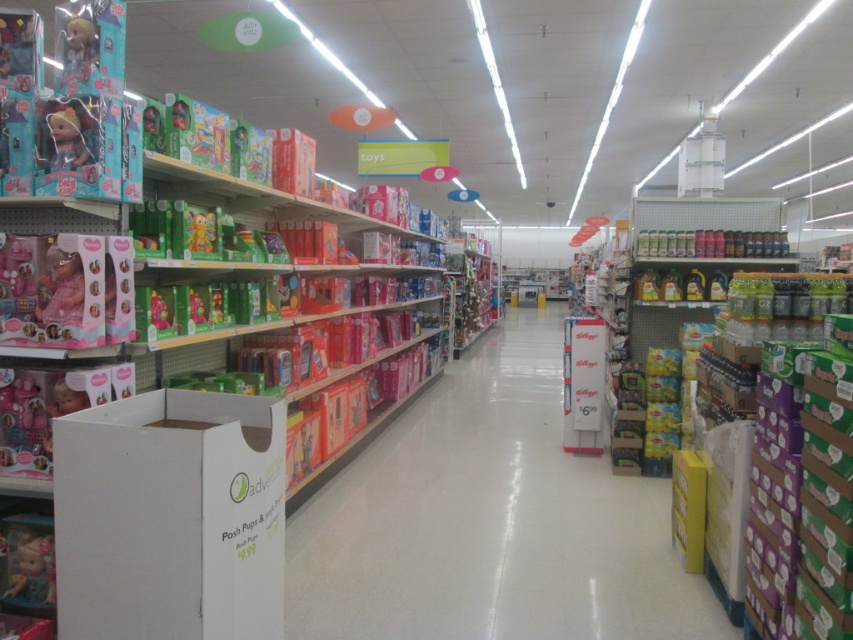
Question: In this image, where is matte cardboard boxes at center located relative to matte plastic doll at left?

Choices:
 (A) right
 (B) left

Answer: (A)

Question: Is matte pink doll at left behind matte pink doll at upper left?

Choices:
 (A) yes
 (B) no

Answer: (B)

Question: Does shiny green plastic toy at left have a larger size compared to matte green toy at upper left?

Choices:
 (A) no
 (B) yes

Answer: (A)

Question: Which object is closer to the camera taking this photo?

Choices:
 (A) matte pink doll at left
 (B) matte pink doll at lower left
 (C) pink matte doll at left

Answer: (A)

Question: Which object is closer to the camera taking this photo?

Choices:
 (A) shiny green plastic toy at left
 (B) matte pink doll at upper left
 (C) matte cardboard boxes at center
 (D) matte pink doll at left

Answer: (D)

Question: Estimate the real-world distances between objects in this image. Which object is closer to the matte pink doll at lower left?

Choices:
 (A) matte plastic doll at left
 (B) shiny green plastic toy at left

Answer: (A)